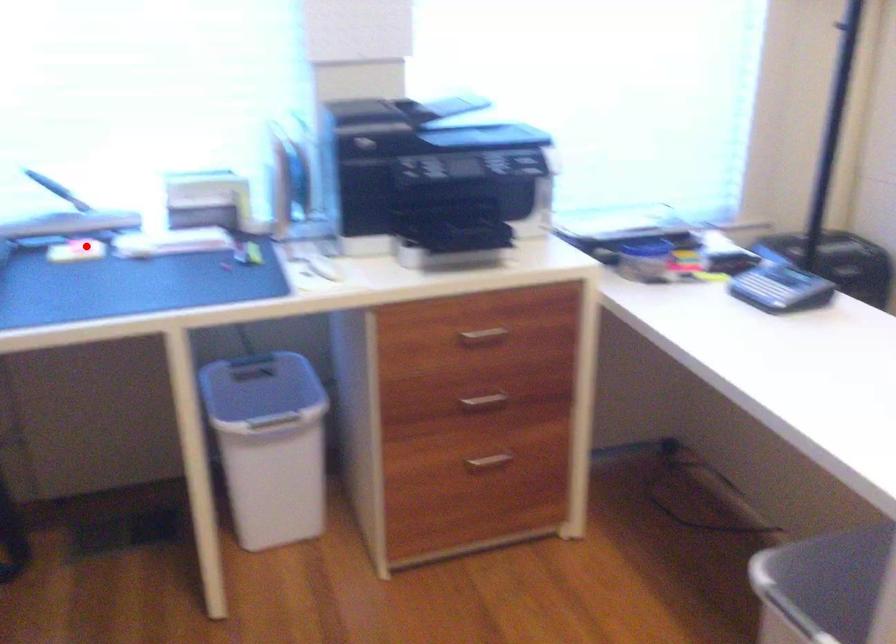
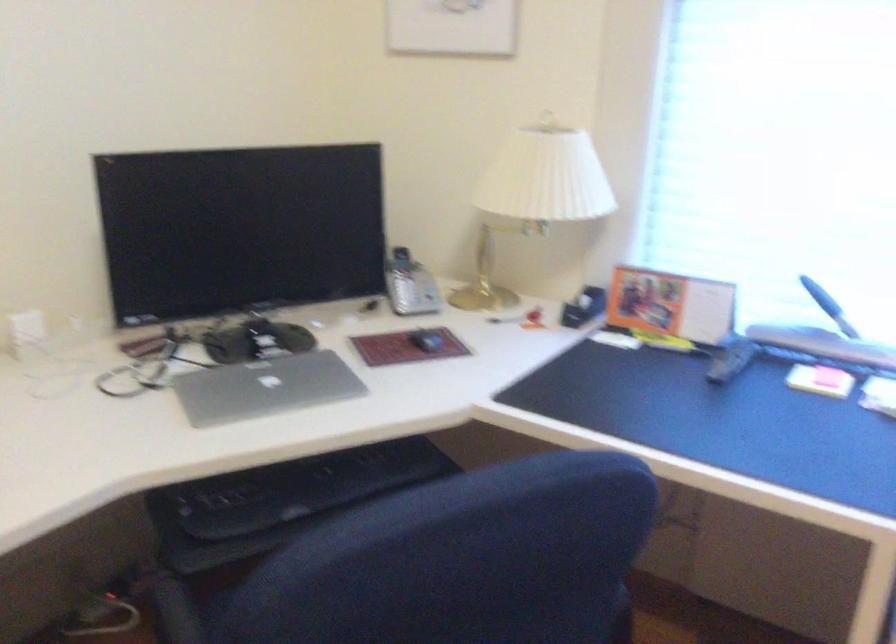
Question: I am providing you with two images of the same scene from different viewpoints. In image1, a red point is highlighted. Considering the same 3D point in image2, which of the following is correct?

Choices:
 (A) It is closer
 (B) It is farther

Answer: (A)